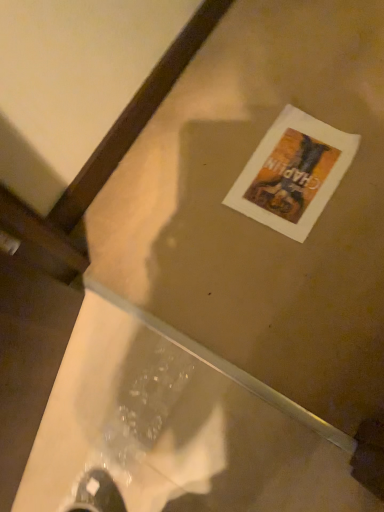
Find the location of a particular element. Image resolution: width=384 pixels, height=512 pixels. free space above white paper book at center (from a real-world perspective) is located at coordinates (292, 170).